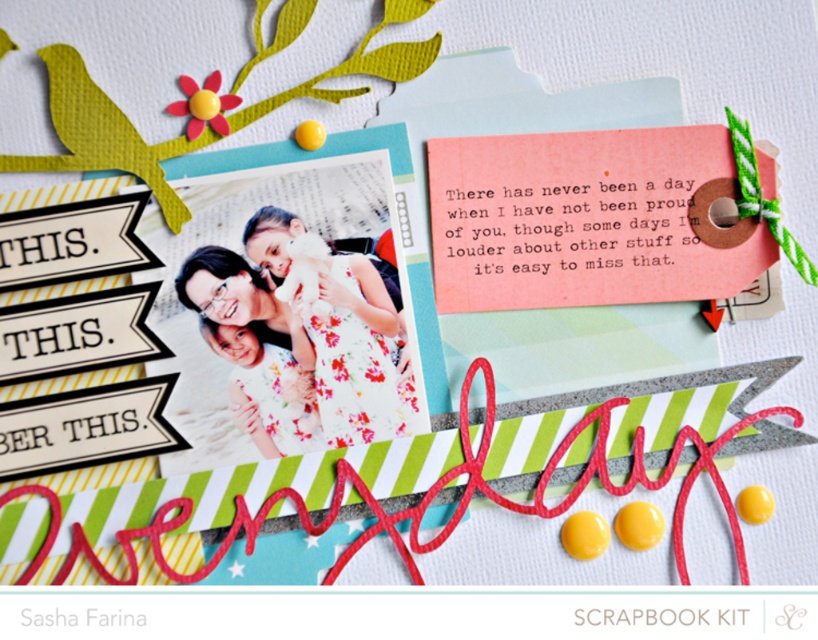
Is pink paper tag at upper right positioned before floral fabric dress at center?

No, it is behind floral fabric dress at center.

Does pink paper tag at upper right appear on the right side of floral fabric dress at center?

Yes, pink paper tag at upper right is to the right of floral fabric dress at center.

Where is `pink paper tag at upper right`? This screenshot has width=818, height=640. pink paper tag at upper right is located at coordinates (587, 220).

You are a GUI agent. You are given a task and a screenshot of the screen. Output one action in this format:
    pyautogui.click(x=<x>, y=<y>)
    Task: Click on the pink paper tag at upper right
    This screenshot has height=640, width=818.
    Given the screenshot: What is the action you would take?
    pyautogui.click(x=587, y=220)